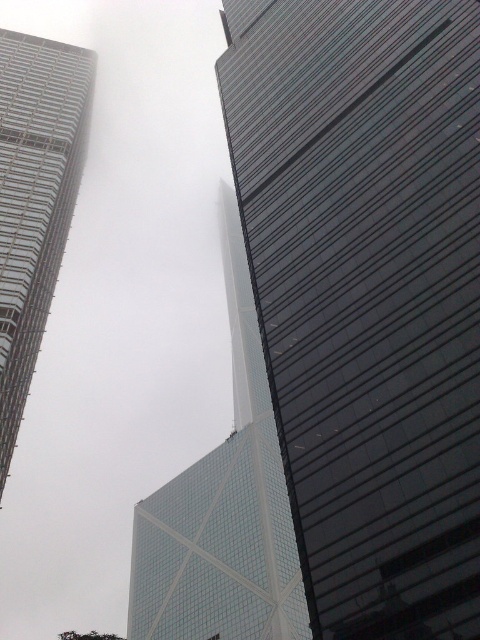
You are standing at the center of the scene and want to take a photo of the glassy reflective skyscraper at right. Which direction should you turn to face it?

The glassy reflective skyscraper at right is located to your right side, so you should turn to your right to face it.

You are standing at the base of the glassy steel skyscraper at left and want to walk towards the glassy reflective skyscraper at right. Which direction should you head?

You should head to the right since the glassy reflective skyscraper at right is located to the right of the glassy steel skyscraper at left.

You are a drone operator tasked with flying a drone between the transparent glass tower at center and the glassy steel skyscraper at left. The drone has a maximum flight distance of 100 meters. Can the drone safely fly between them without exceeding its range?

The transparent glass tower at center is 99.95 meters away from the glassy steel skyscraper at left. Since the drone has a maximum flight distance of 100 meters, it can safely fly between them as the distance is just under the limit.